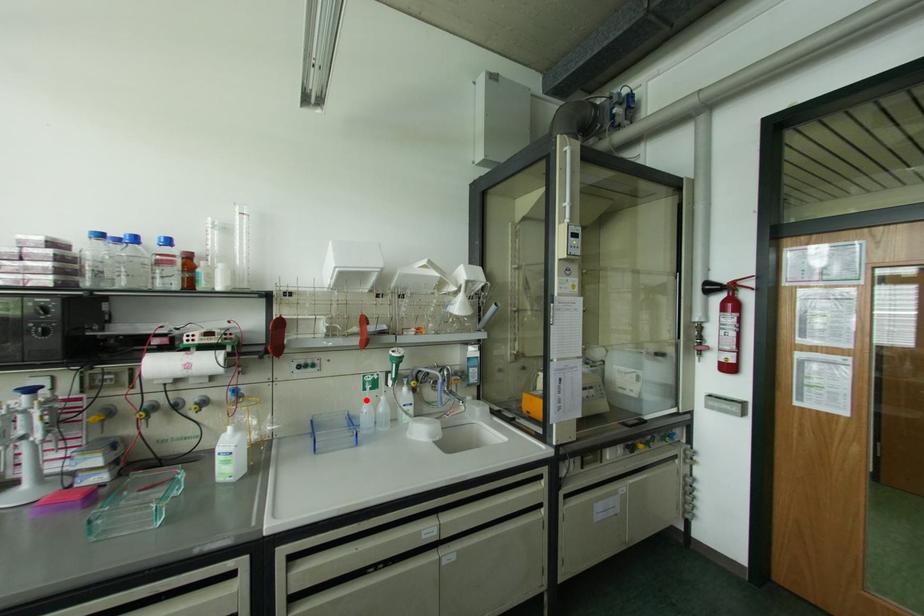
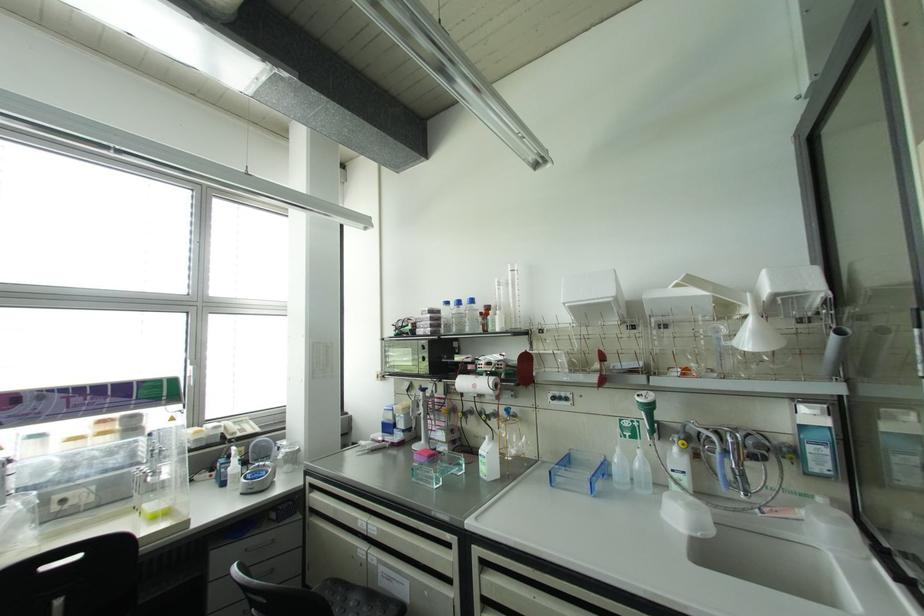
Question: I am providing you with two images of the same scene from different viewpoints. A red point is marked on the first image. Is the red point's position out of view in image 2?

Choices:
 (A) Yes
 (B) No

Answer: (B)